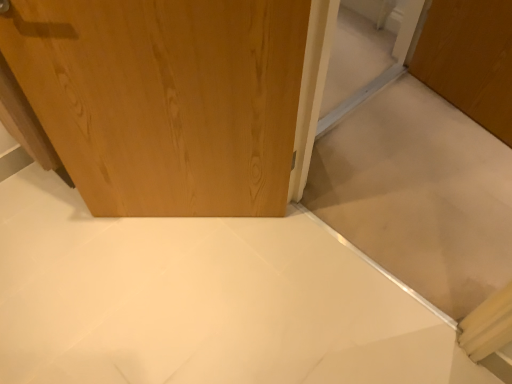
The image size is (512, 384). I want to click on free space in front of wooden door at upper left, so click(176, 300).